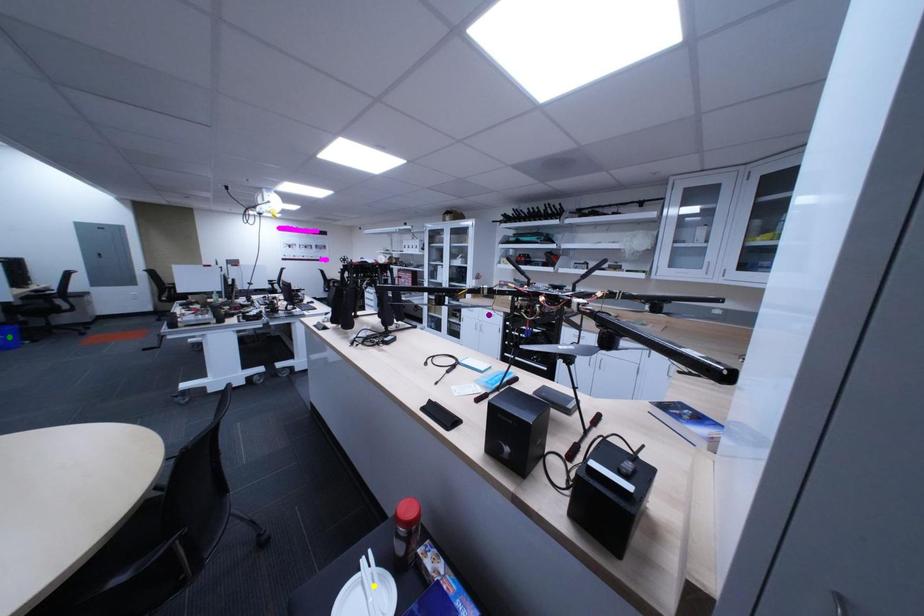
Order these from farthest to nearest:
purple point
green point
yellow point

purple point, green point, yellow point